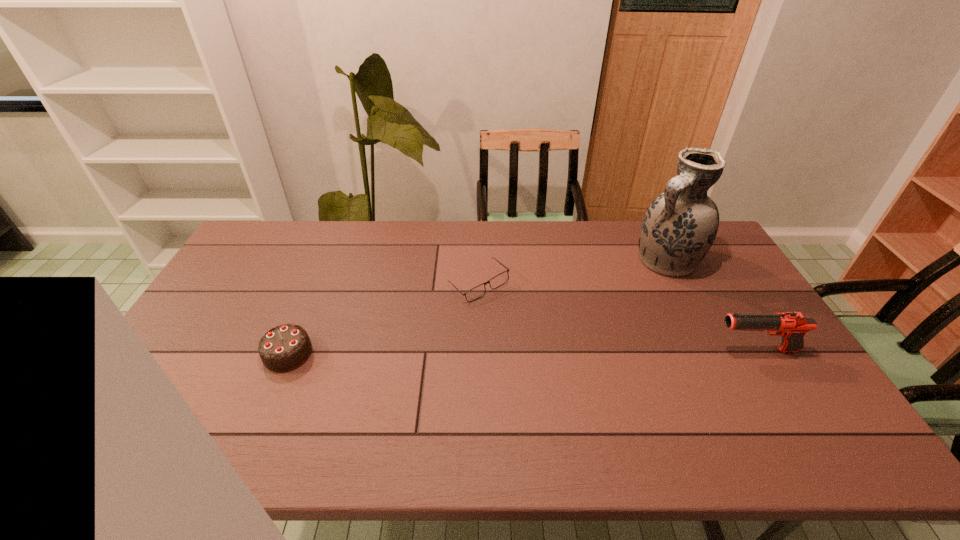
Identify the location of free spot between the vase and the spectacles. (573, 273).

Image resolution: width=960 pixels, height=540 pixels. What are the coordinates of `blank region between the vase and the shortest object` in the screenshot? It's located at (573, 273).

The image size is (960, 540). I want to click on unoccupied position between the gun and the third tallest object, so click(x=522, y=352).

At what (x,y) coordinates should I click in order to perform the action: click on unoccupied area between the vase and the third shortest object. Please return your answer as a coordinate pair (x, y). Looking at the image, I should click on (711, 306).

At what (x,y) coordinates should I click in order to perform the action: click on the third closest object to the second tallest object. Please return your answer as a coordinate pair (x, y). Looking at the image, I should click on (284, 348).

Find the location of `object that is the closest to the second tallest object`. object that is the closest to the second tallest object is located at coordinates (679, 227).

Locate an element on the screen. This screenshot has width=960, height=540. free point that satisfies the following two spatial constraints: 1. on the front side of the third shortest object; 2. at the aiming end of the second object from left to right is located at coordinates (478, 350).

At what (x,y) coordinates should I click in order to perform the action: click on free space that satisfies the following two spatial constraints: 1. on the back side of the gun; 2. at the aiming end of the third tallest object. Please return your answer as a coordinate pair (x, y). Looking at the image, I should click on (290, 350).

I want to click on vacant space that satisfies the following two spatial constraints: 1. on the back side of the second tallest object; 2. at the aiming end of the leftmost object, so click(x=290, y=350).